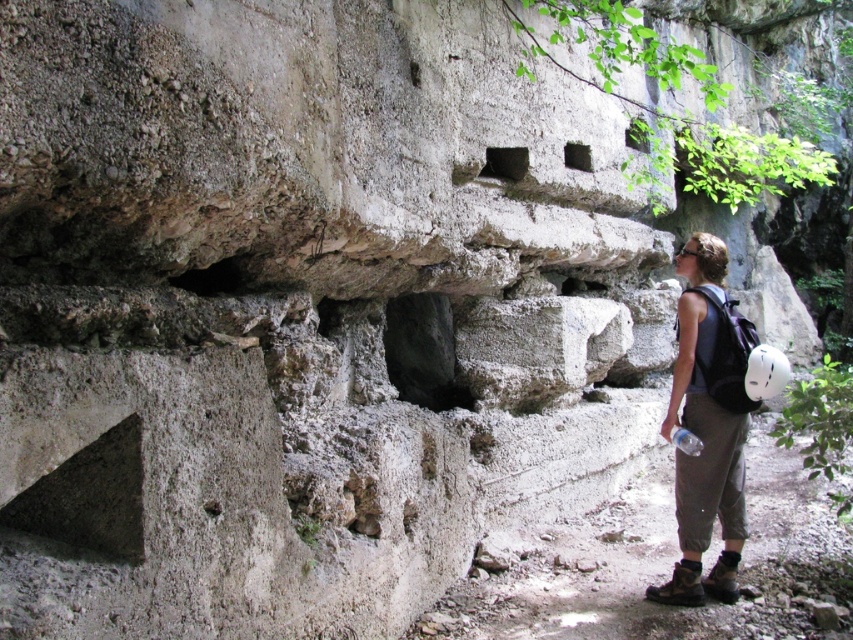
Does dark gray fabric backpack at right come behind dark stone cave at center?

No.

Is point (718, 328) positioned in front of point (393, 369)?

Yes, it is in front of point (393, 369).

Where is `dark gray fabric backpack at right`? dark gray fabric backpack at right is located at coordinates (706, 429).